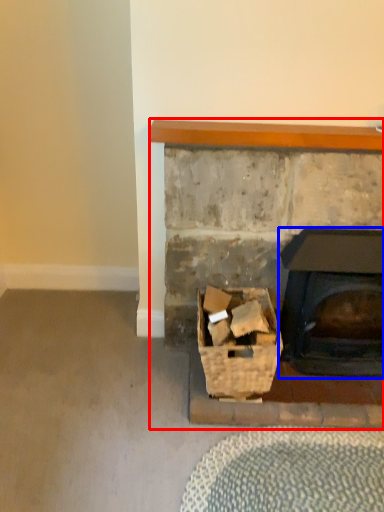
Question: Which object appears closest to the camera in this image, fireplace (highlighted by a red box) or wood burning stove (highlighted by a blue box)?

Choices:
 (A) fireplace
 (B) wood burning stove

Answer: (A)